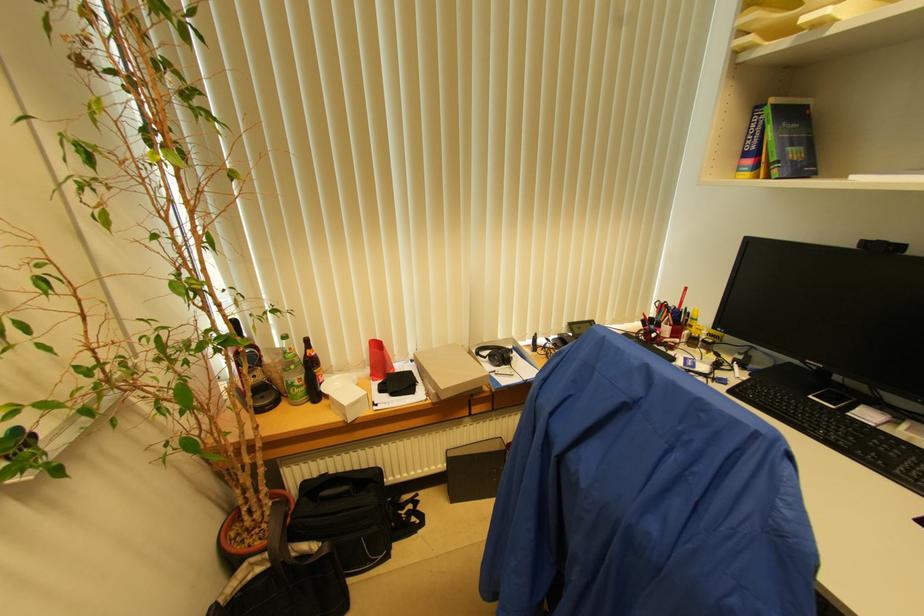
You are a GUI agent. You are given a task and a screenshot of the screen. Output one action in this format:
    pyautogui.click(x=<x>, y=<y>)
    Task: Click on the black box file
    The width and height of the screenshot is (924, 616).
    Given the screenshot: What is the action you would take?
    pyautogui.click(x=475, y=469)